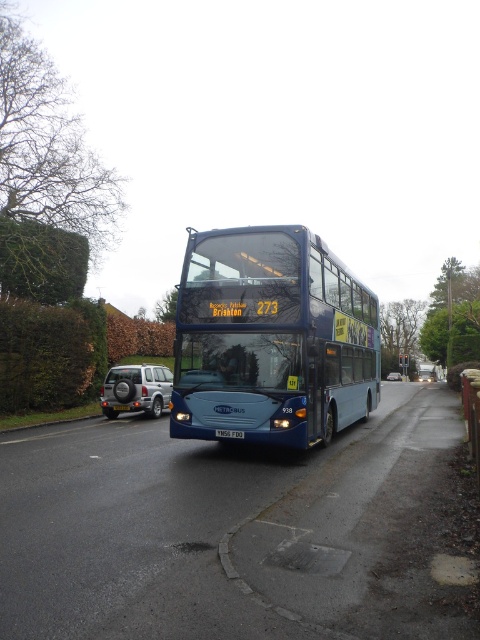
Is point (199, 269) closer to camera compared to point (402, 378)?

Yes, point (199, 269) is closer to viewer.

Can you confirm if blue metallic bus at center is positioned above silver metallic car at center?

Indeed, blue metallic bus at center is positioned over silver metallic car at center.

Is point (249, 227) positioned in front of point (392, 372)?

Yes.

Identify the location of blue metallic bus at center. The width and height of the screenshot is (480, 640). (272, 339).

Is point (229, 246) positioned before point (69, 332)?

Yes, it is in front of point (69, 332).

Is blue metallic bus at center further to the viewer compared to green leafy hedge at left?

No, blue metallic bus at center is closer to the viewer.

Is point (314, 241) in front of point (0, 330)?

Yes, point (314, 241) is in front of point (0, 330).

Find the location of a particular element. The height and width of the screenshot is (640, 480). blue metallic bus at center is located at coordinates (272, 339).

Can you confirm if blue metallic bus at center is smaller than silver metallic suv at lower left?

No.

Is blue metallic bus at center positioned behind silver metallic suv at lower left?

That is False.

You are a GUI agent. You are given a task and a screenshot of the screen. Output one action in this format:
    pyautogui.click(x=<x>, y=<y>)
    Task: Click on the blue metallic bus at center
    Image resolution: width=480 pixels, height=640 pixels.
    Given the screenshot: What is the action you would take?
    pyautogui.click(x=272, y=339)